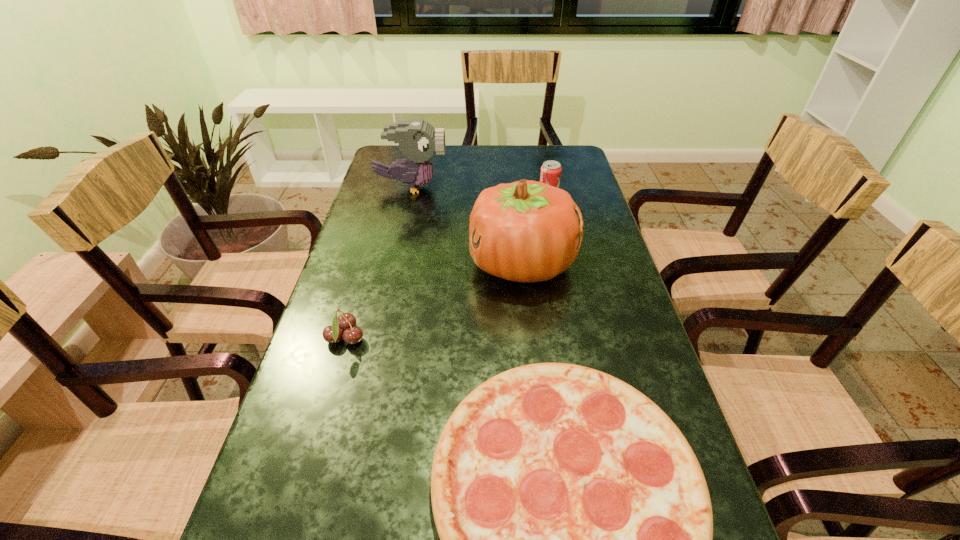
Where is `free spot that satisfies the following two spatial constraints: 1. on the back side of the third shortest object; 2. at the beak of the bird`? The image size is (960, 540). free spot that satisfies the following two spatial constraints: 1. on the back side of the third shortest object; 2. at the beak of the bird is located at coordinates (547, 187).

The height and width of the screenshot is (540, 960). In order to click on blank space that satisfies the following two spatial constraints: 1. on the front side of the soda can; 2. on the side of the pumpkin with the cute face in this screenshot , I will do `click(564, 263)`.

Where is `vacant position in the image that satisfies the following two spatial constraints: 1. at the beak of the third shortest object; 2. on the left side of the bird`? The width and height of the screenshot is (960, 540). vacant position in the image that satisfies the following two spatial constraints: 1. at the beak of the third shortest object; 2. on the left side of the bird is located at coordinates (410, 194).

Where is `blank space that satisfies the following two spatial constraints: 1. on the front side of the third shortest object; 2. on the leaves of the second shortest object`? The image size is (960, 540). blank space that satisfies the following two spatial constraints: 1. on the front side of the third shortest object; 2. on the leaves of the second shortest object is located at coordinates (580, 339).

What are the coordinates of `free space that satisfies the following two spatial constraints: 1. at the beak of the soda can; 2. on the left side of the bird` in the screenshot? It's located at point(410,194).